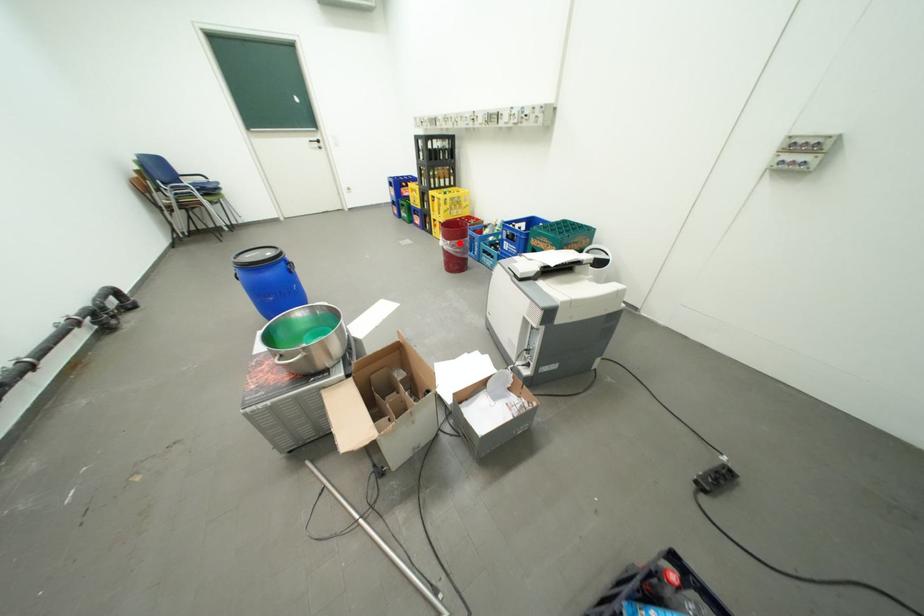
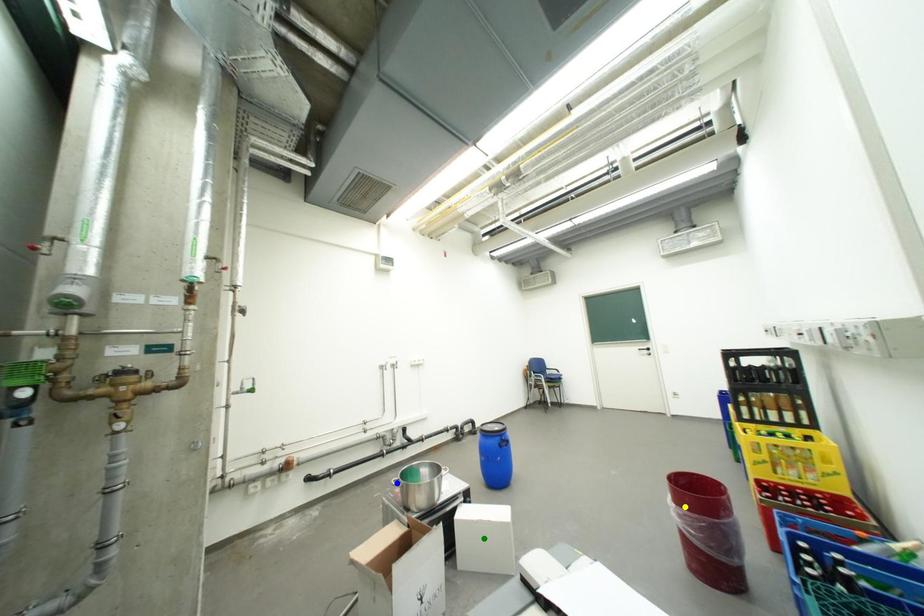
Question: I am providing you with two images of the same scene from different viewpoints. A red point is marked on the first image. You are given multiple points on the second image. Which point in image 2 is actually the same real-world point as the red point in image 1?

Choices:
 (A) blue point
 (B) green point
 (C) yellow point

Answer: (C)